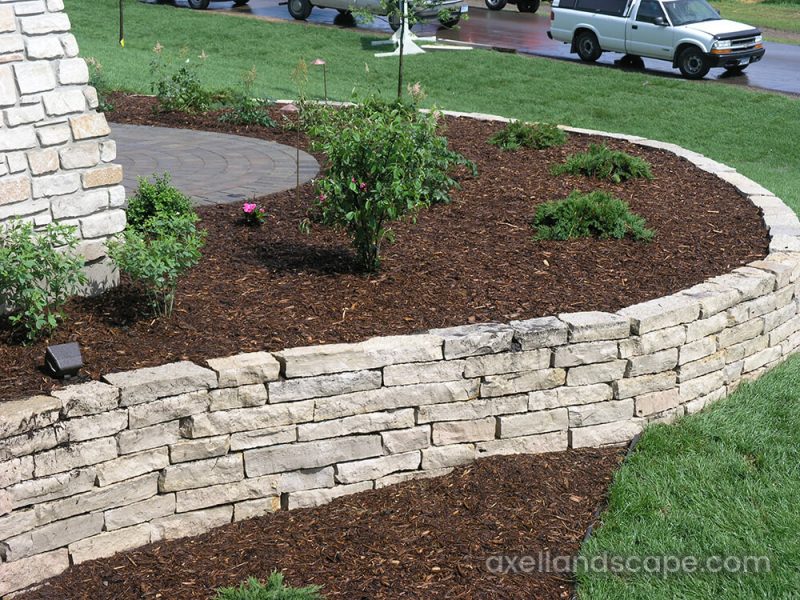
What are the coordinates of `brick wall` in the screenshot? It's located at (381, 424).